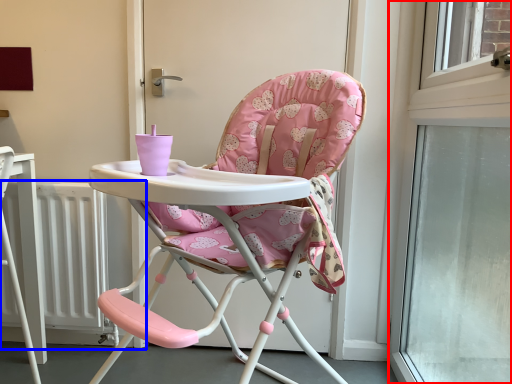
Question: Which of the following is the closest to the observer, window (highlighted by a red box) or radiator (highlighted by a blue box)?

Choices:
 (A) window
 (B) radiator

Answer: (A)